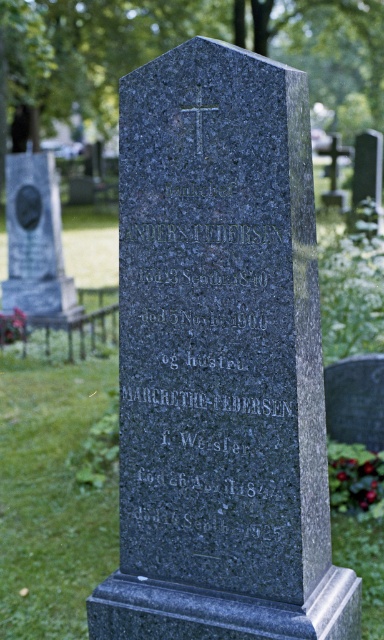
Where is the granite gravestone at center located in the image?

The granite gravestone at center is located at point (x=220, y=362) in the image.